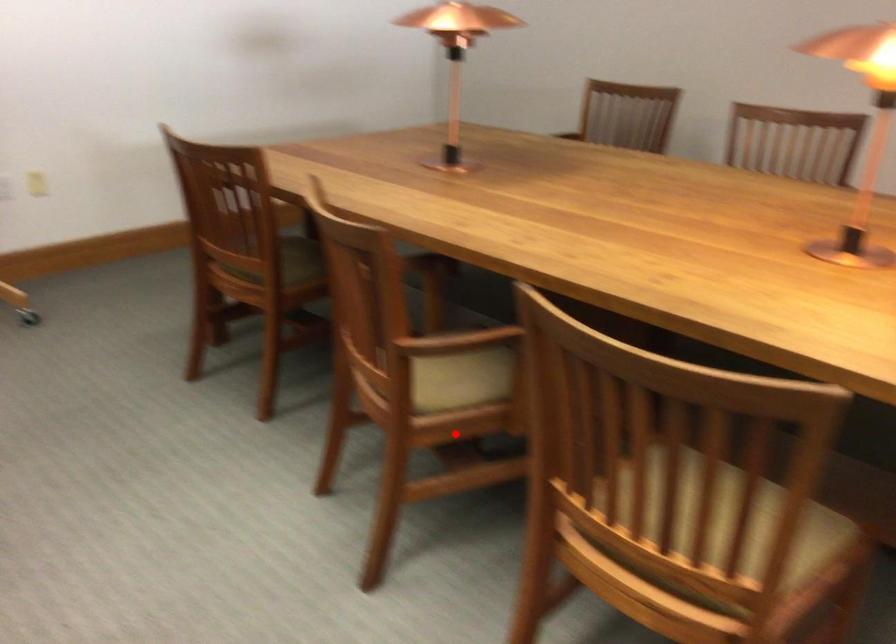
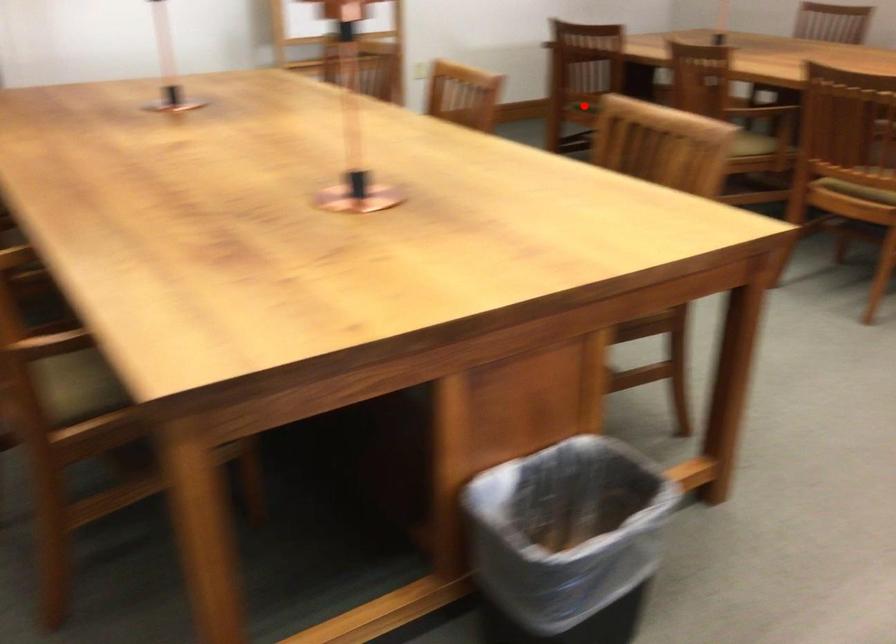
I am providing you with two images of the same scene from different viewpoints. A red point is marked on the first image and another point is marked on the second image. Do the highlighted points in image1 and image2 indicate the same real-world spot?

No